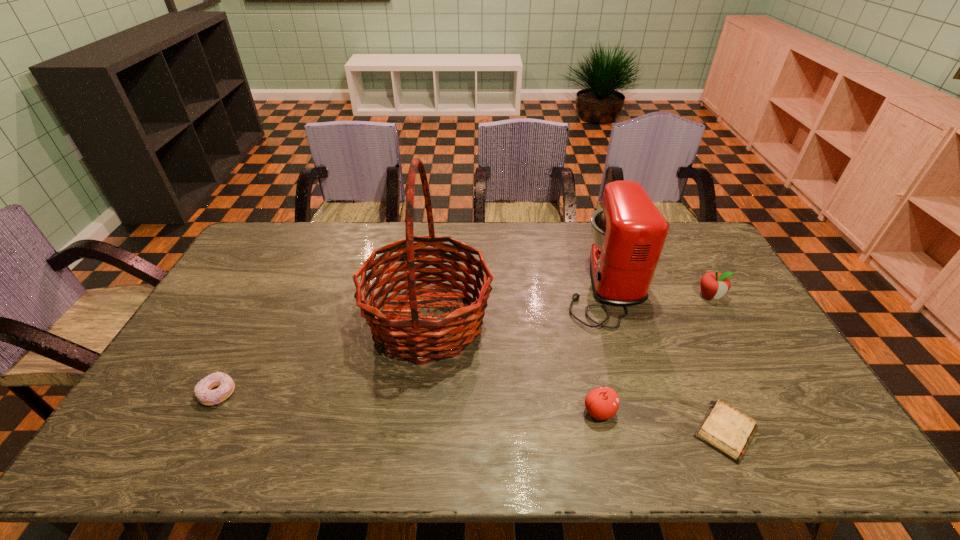
Where is `free space that satisfies the following two spatial constraints: 1. on the front-facing side of the diary; 2. on the right side of the kitchen mixer`? free space that satisfies the following two spatial constraints: 1. on the front-facing side of the diary; 2. on the right side of the kitchen mixer is located at coordinates (650, 431).